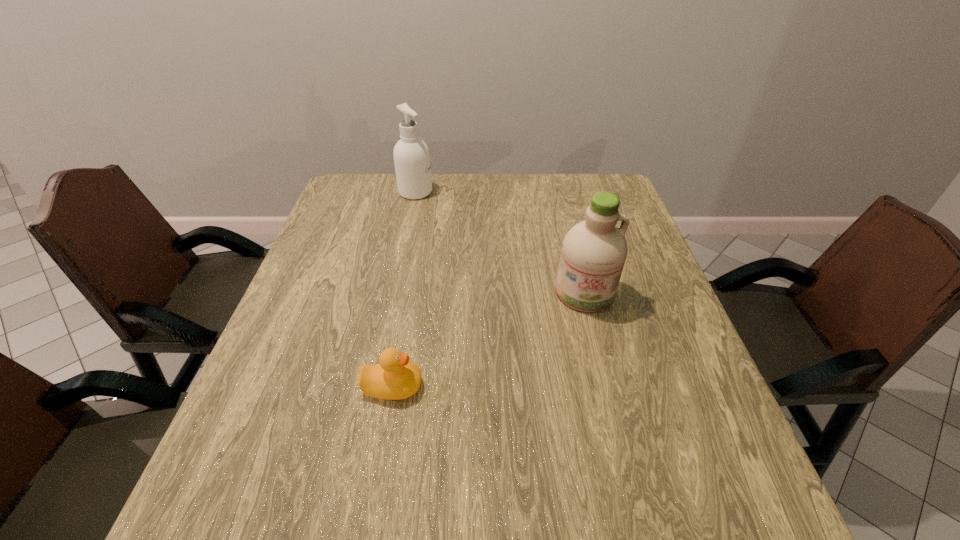
Locate an element on the screen. Image resolution: width=960 pixels, height=540 pixels. free spot between the right cleansing agent and the shortest object is located at coordinates (489, 340).

Find the location of a particular element. vacant area that lies between the right cleansing agent and the shortest object is located at coordinates (489, 340).

The width and height of the screenshot is (960, 540). Identify the location of vacant area between the shortest object and the rightmost object. (489, 340).

Locate an element on the screen. Image resolution: width=960 pixels, height=540 pixels. vacant space that's between the left cleansing agent and the nearest object is located at coordinates (404, 289).

I want to click on free space between the right cleansing agent and the duck, so click(x=489, y=340).

You are a GUI agent. You are given a task and a screenshot of the screen. Output one action in this format:
    pyautogui.click(x=<x>, y=<y>)
    Task: Click on the free space between the rightmost object and the left cleansing agent
    This screenshot has height=540, width=960.
    Given the screenshot: What is the action you would take?
    (500, 242)

The image size is (960, 540). I want to click on free space between the second nearest object and the farthest object, so click(x=500, y=242).

The height and width of the screenshot is (540, 960). What are the coordinates of `the second closest object relative to the right cleansing agent` in the screenshot? It's located at (411, 155).

You are a GUI agent. You are given a task and a screenshot of the screen. Output one action in this format:
    pyautogui.click(x=<x>, y=<y>)
    Task: Click on the object that is the second closest to the shortest object
    The width and height of the screenshot is (960, 540).
    Given the screenshot: What is the action you would take?
    (x=411, y=155)

I want to click on blank area in the image that satisfies the following two spatial constraints: 1. on the front label of the nearer cleansing agent; 2. on the face of the nearest object, so click(608, 386).